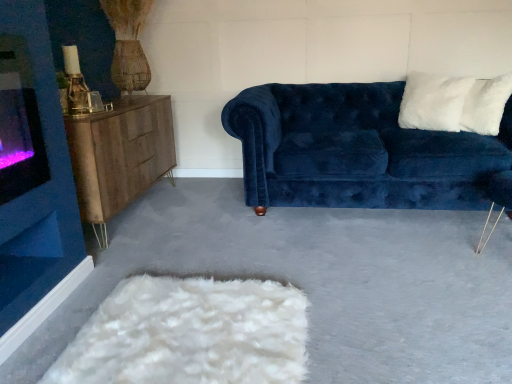
Question: Is velvet blue couch at center taller than wooden sideboard at left?

Choices:
 (A) yes
 (B) no

Answer: (A)

Question: Would you say velvet blue couch at center contains wooden sideboard at left?

Choices:
 (A) yes
 (B) no

Answer: (B)

Question: Is velvet blue couch at center next to wooden sideboard at left?

Choices:
 (A) no
 (B) yes

Answer: (A)

Question: Would you say velvet blue couch at center is a long distance from wooden sideboard at left?

Choices:
 (A) yes
 (B) no

Answer: (A)

Question: Can you confirm if velvet blue couch at center is bigger than wooden sideboard at left?

Choices:
 (A) no
 (B) yes

Answer: (B)

Question: In terms of width, does wooden sideboard at left look wider or thinner when compared to white fluffy pillow at upper right?

Choices:
 (A) wide
 (B) thin

Answer: (A)

Question: In terms of size, does wooden sideboard at left appear bigger or smaller than white fluffy pillow at upper right?

Choices:
 (A) small
 (B) big

Answer: (B)

Question: Considering their positions, is wooden sideboard at left located in front of or behind white fluffy pillow at upper right?

Choices:
 (A) behind
 (B) front

Answer: (B)

Question: From a real-world perspective, is wooden sideboard at left physically located above or below white fluffy pillow at upper right?

Choices:
 (A) below
 (B) above

Answer: (A)

Question: Would you say velvet blue couch at center is to the left or to the right of wooden sideboard at left in the picture?

Choices:
 (A) right
 (B) left

Answer: (A)

Question: Choose the correct answer: Is velvet blue couch at center inside wooden sideboard at left or outside it?

Choices:
 (A) outside
 (B) inside

Answer: (A)

Question: Looking at their shapes, would you say velvet blue couch at center is wider or thinner than wooden sideboard at left?

Choices:
 (A) thin
 (B) wide

Answer: (B)

Question: Does point (287, 158) appear closer or farther from the camera than point (130, 114)?

Choices:
 (A) farther
 (B) closer

Answer: (A)

Question: From a real-world perspective, relative to wooden sideboard at left, is white fluffy pillow at upper right vertically above or below?

Choices:
 (A) below
 (B) above

Answer: (B)

Question: From the image's perspective, is white fluffy pillow at upper right positioned above or below wooden sideboard at left?

Choices:
 (A) below
 (B) above

Answer: (B)